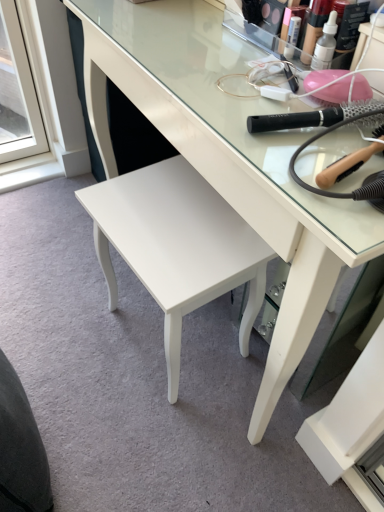
You are a GUI agent. You are given a task and a screenshot of the screen. Output one action in this format:
    pyautogui.click(x=<x>, y=<y>)
    Task: Click on the vacant area situated to the left side of wooden-handled hairbrush at upper right, marked as the 2th brush in a top-to-bottom arrangement
    
    Given the screenshot: What is the action you would take?
    pyautogui.click(x=266, y=140)